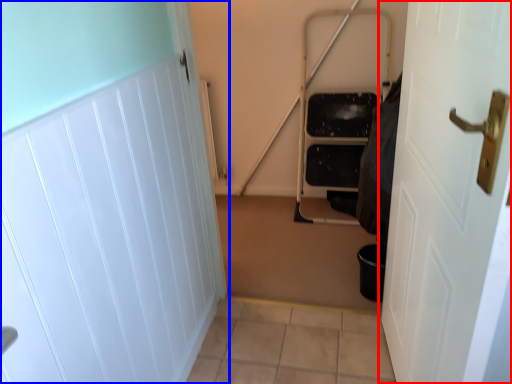
Question: Which point is closer to the camera, door (highlighted by a red box) or door (highlighted by a blue box)?

Choices:
 (A) door
 (B) door

Answer: (A)